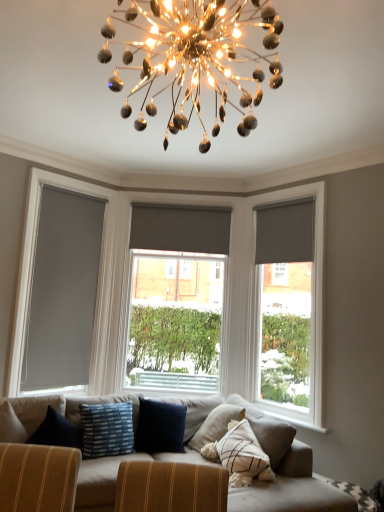
The height and width of the screenshot is (512, 384). I want to click on shiny metallic chandelier at upper center, so pos(195,58).

At what (x,y) coordinates should I click in order to perform the action: click on matte gray roller blind at right, marked as the second window in a left-to-right arrangement. Please return your answer as a coordinate pair (x, y). This screenshot has width=384, height=512. Looking at the image, I should click on (291, 308).

The height and width of the screenshot is (512, 384). I want to click on matte gray curtain at center, the second curtain from the right, so click(x=180, y=228).

This screenshot has height=512, width=384. I want to click on blue striped fabric pillow at center, so [107, 429].

Locate an element on the screen. studio couch in front of the matte gray curtain at center, marked as the 2th curtain in a front-to-back arrangement is located at coordinates (156, 483).

Does textured beige couch at center have a smaller size compared to matte gray curtain at center, placed as the first curtain when sorted from back to front?

No, textured beige couch at center is not smaller than matte gray curtain at center, placed as the first curtain when sorted from back to front.

Is textured beige couch at center facing away from matte gray curtain at center, placed as the first curtain when sorted from back to front?

textured beige couch at center is not turned away from matte gray curtain at center, placed as the first curtain when sorted from back to front.

What's the angular difference between shiny metallic chandelier at upper center and matte gray roller blind at right, arranged as the first window when viewed from the right,'s facing directions?

There is a 136-degree angle between the facing directions of shiny metallic chandelier at upper center and matte gray roller blind at right, arranged as the first window when viewed from the right.

Which of these two, shiny metallic chandelier at upper center or matte gray roller blind at right, arranged as the first window when viewed from the right, stands taller?

matte gray roller blind at right, arranged as the first window when viewed from the right, is taller.

From the image's perspective, does shiny metallic chandelier at upper center appear lower than matte gray roller blind at right, marked as the second window in a left-to-right arrangement?

Incorrect, from the image's perspective, shiny metallic chandelier at upper center is higher than matte gray roller blind at right, marked as the second window in a left-to-right arrangement.

Between shiny metallic chandelier at upper center and matte gray roller blind at right, marked as the second window in a left-to-right arrangement, which one appears on the right side from the viewer's perspective?

matte gray roller blind at right, marked as the second window in a left-to-right arrangement, is more to the right.

Measure the distance between matte gray roller blind at center, placed as the 2th window when sorted from right to left, and matte gray roller blind at right, marked as the second window in a left-to-right arrangement.

A distance of 35.01 inches exists between matte gray roller blind at center, placed as the 2th window when sorted from right to left, and matte gray roller blind at right, marked as the second window in a left-to-right arrangement.

Is matte gray roller blind at right, arranged as the first window when viewed from the right, inside matte gray roller blind at center, which is the 1th window from left to right?

No, matte gray roller blind at right, arranged as the first window when viewed from the right, is located outside of matte gray roller blind at center, which is the 1th window from left to right.

Which of these two, matte gray roller blind at center, placed as the 2th window when sorted from right to left, or matte gray roller blind at right, arranged as the first window when viewed from the right, is wider?

matte gray roller blind at center, placed as the 2th window when sorted from right to left.

From the image's perspective, does matte gray roller blind at center, which is the 1th window from left to right, appear lower than matte gray roller blind at right, marked as the second window in a left-to-right arrangement?

Actually, matte gray roller blind at center, which is the 1th window from left to right, appears above matte gray roller blind at right, marked as the second window in a left-to-right arrangement, in the image.

Can you confirm if matte gray roller blind at right, arranged as the first window when viewed from the right, is bigger than blue striped fabric pillow at center?

Indeed, matte gray roller blind at right, arranged as the first window when viewed from the right, has a larger size compared to blue striped fabric pillow at center.

Is point (313, 274) more distant than point (105, 441)?

Yes, point (313, 274) is behind point (105, 441).

What's the angular difference between matte gray roller blind at right, arranged as the first window when viewed from the right, and blue striped fabric pillow at center's facing directions?

They differ by 77.7 degrees in their facing directions.

Is matte gray roller blind at right, arranged as the first window when viewed from the right, looking in the opposite direction of blue striped fabric pillow at center?

No.

Which is more to the right, matte gray roller blind at left or matte gray roller blind at center, placed as the 2th window when sorted from right to left?

From the viewer's perspective, matte gray roller blind at center, placed as the 2th window when sorted from right to left, appears more on the right side.

Can matte gray roller blind at center, which is the 1th window from left to right, be found inside matte gray roller blind at left?

Definitely not — matte gray roller blind at center, which is the 1th window from left to right, is not inside matte gray roller blind at left.

From a real-world perspective, is matte gray roller blind at left located higher than matte gray roller blind at center, which is the 1th window from left to right?

Yes.

Considering the positions of objects matte gray roller blind at left and matte gray roller blind at center, which is the 1th window from left to right, in the image provided, who is behind, matte gray roller blind at left or matte gray roller blind at center, which is the 1th window from left to right,?

matte gray roller blind at center, which is the 1th window from left to right.

Does matte gray roller blind at right, arranged as the first window when viewed from the right, appear on the left side of matte gray curtain at center, the second curtain from the right?

No.

Considering the sizes of objects matte gray roller blind at right, arranged as the first window when viewed from the right, and matte gray curtain at center, the second curtain from the right, in the image provided, who is shorter, matte gray roller blind at right, arranged as the first window when viewed from the right, or matte gray curtain at center, the second curtain from the right,?

matte gray curtain at center, the second curtain from the right.

From a real-world perspective, which is physically above, matte gray roller blind at right, arranged as the first window when viewed from the right, or matte gray curtain at center, positioned as the 1th curtain in left-to-right order?

matte gray curtain at center, positioned as the 1th curtain in left-to-right order, from a real-world perspective.

Relative to matte gray curtain at center, marked as the 2th curtain in a front-to-back arrangement, is matte gray roller blind at right, marked as the second window in a left-to-right arrangement, in front or behind?

Clearly, matte gray roller blind at right, marked as the second window in a left-to-right arrangement, is in front of matte gray curtain at center, marked as the 2th curtain in a front-to-back arrangement.

Is point (247, 22) positioned behind point (52, 506)?

Yes, it is.

Is shiny metallic chandelier at upper center oriented away from textured beige couch at center?

No, shiny metallic chandelier at upper center is not facing away from textured beige couch at center.

Which object is further away from the camera, shiny metallic chandelier at upper center or textured beige couch at center?

textured beige couch at center is further away from the camera.

Can you tell me how much shiny metallic chandelier at upper center and textured beige couch at center differ in facing direction?

shiny metallic chandelier at upper center and textured beige couch at center are facing 156 degrees away from each other.

Identify the location of studio couch located below the matte gray curtain at center, the second curtain from the right (from the image's perspective). (156, 483).

Image resolution: width=384 pixels, height=512 pixels. Identify the location of chandelier in front of the matte gray roller blind at right, marked as the second window in a left-to-right arrangement. (195, 58).

Based on their spatial positions, is matte gray roller blind at right, marked as the second window in a left-to-right arrangement, or shiny metallic chandelier at upper center closer to matte gray roller blind at right, positioned as the first curtain in right-to-left order?

Among the two, matte gray roller blind at right, marked as the second window in a left-to-right arrangement, is located nearer to matte gray roller blind at right, positioned as the first curtain in right-to-left order.

Which object lies nearer to the anchor point blue striped fabric pillow at center, shiny metallic chandelier at upper center or matte gray roller blind at right, positioned as the first curtain in right-to-left order?

The object closer to blue striped fabric pillow at center is matte gray roller blind at right, positioned as the first curtain in right-to-left order.

Based on their spatial positions, is shiny metallic chandelier at upper center or blue striped fabric pillow at center further from matte gray curtain at center, marked as the 2th curtain in a front-to-back arrangement?

blue striped fabric pillow at center is further to matte gray curtain at center, marked as the 2th curtain in a front-to-back arrangement.

When comparing their distances from matte gray curtain at center, marked as the 2th curtain in a front-to-back arrangement, does shiny metallic chandelier at upper center or matte gray roller blind at center, which is the 1th window from left to right, seem further?

Among the two, shiny metallic chandelier at upper center is located further to matte gray curtain at center, marked as the 2th curtain in a front-to-back arrangement.

Based on their spatial positions, is matte gray roller blind at left or matte gray roller blind at right, marked as the second window in a left-to-right arrangement, closer to matte gray curtain at center, the second curtain from the right?

matte gray roller blind at left lies closer to matte gray curtain at center, the second curtain from the right, than the other object.

Based on their spatial positions, is matte gray curtain at center, the second curtain from the right, or shiny metallic chandelier at upper center further from matte gray roller blind at right, marked as the second window in a left-to-right arrangement?

The object further to matte gray roller blind at right, marked as the second window in a left-to-right arrangement, is shiny metallic chandelier at upper center.

From the image, which object appears to be nearer to matte gray curtain at center, marked as the 2th curtain in a front-to-back arrangement, blue striped fabric pillow at center or matte gray roller blind at right, the first curtain positioned from the front?

matte gray roller blind at right, the first curtain positioned from the front, lies closer to matte gray curtain at center, marked as the 2th curtain in a front-to-back arrangement, than the other object.

Looking at the image, which one is located further to matte gray roller blind at right, placed as the 2th curtain when sorted from back to front, textured beige couch at center or matte gray roller blind at left?

textured beige couch at center is further to matte gray roller blind at right, placed as the 2th curtain when sorted from back to front.

Where is `window screen positioned between shiny metallic chandelier at upper center and matte gray roller blind at right, positioned as the first curtain in right-to-left order, from near to far`? window screen positioned between shiny metallic chandelier at upper center and matte gray roller blind at right, positioned as the first curtain in right-to-left order, from near to far is located at coordinates (33, 261).

You are a GUI agent. You are given a task and a screenshot of the screen. Output one action in this format:
    pyautogui.click(x=<x>, y=<y>)
    Task: Click on the window screen between textured beige couch at center and matte gray curtain at center, the second curtain from the right, in the front-back direction
    
    Given the screenshot: What is the action you would take?
    pos(33,261)

At what (x,y) coordinates should I click in order to perform the action: click on studio couch positioned between shiny metallic chandelier at upper center and matte gray roller blind at right, marked as the second window in a left-to-right arrangement, from near to far. Please return your answer as a coordinate pair (x, y). Looking at the image, I should click on (156, 483).

What are the coordinates of `pillow between matte gray roller blind at right, arranged as the 2th curtain when viewed from the left, and textured beige couch at center in the up-down direction` in the screenshot? It's located at (107, 429).